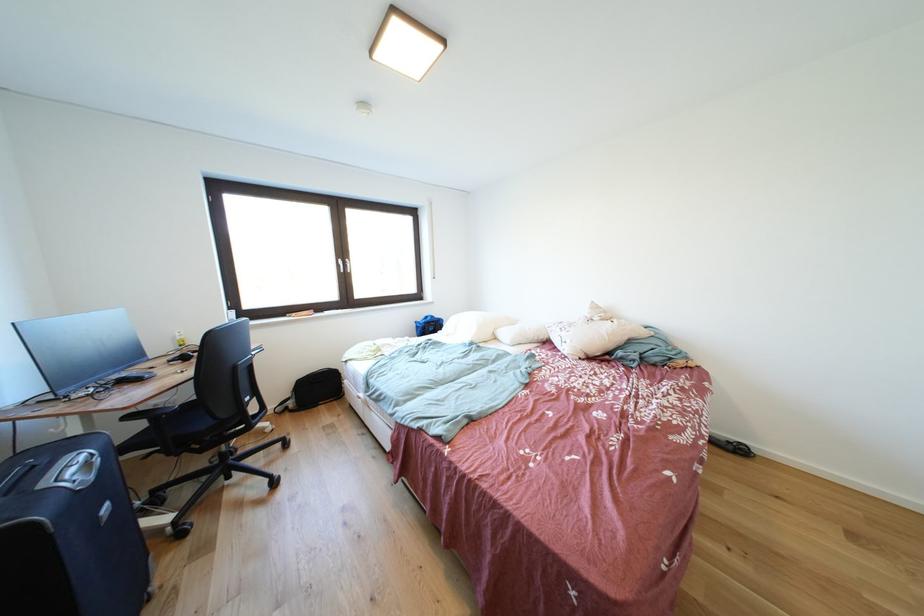
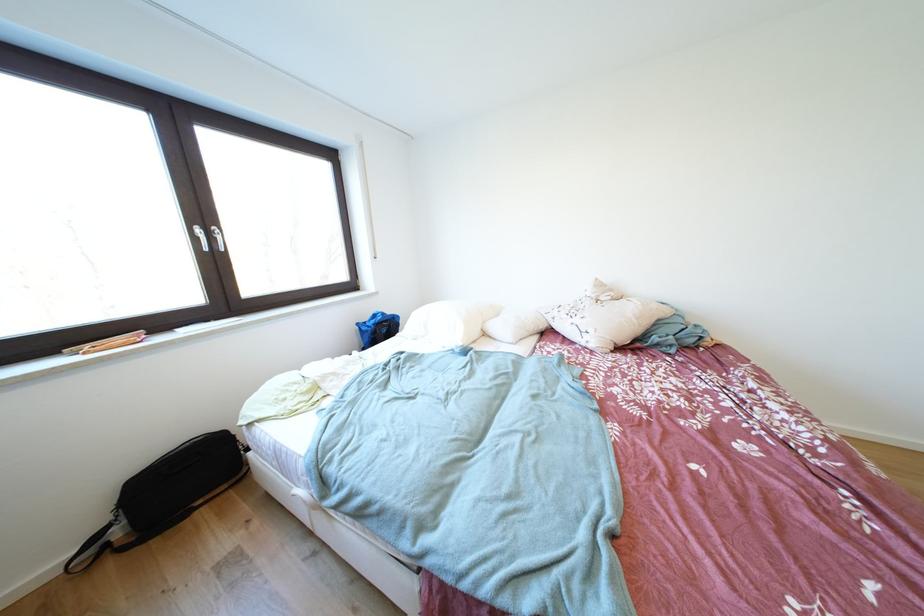
Question: The first image is from the beginning of the video and the second image is from the end. How did the camera likely rotate when shooting the video?

Choices:
 (A) Left
 (B) Right
 (C) Up
 (D) Down

Answer: (B)